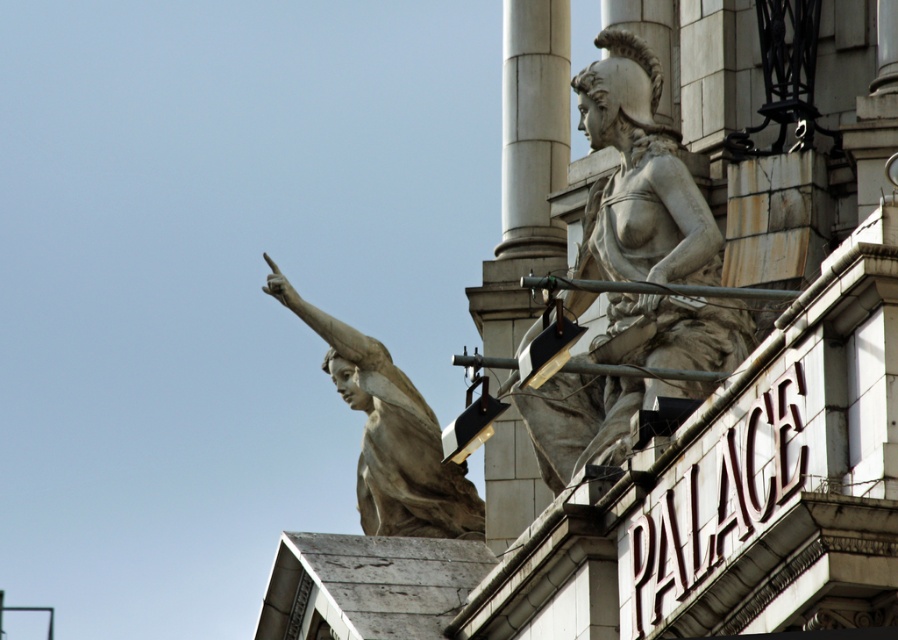
Question: Does white stone pillar at upper right have a greater width compared to matte stone statue at upper left?

Choices:
 (A) yes
 (B) no

Answer: (B)

Question: Which point is farther from the camera taking this photo?

Choices:
 (A) (693, 349)
 (B) (389, 484)

Answer: (B)

Question: From the image, what is the correct spatial relationship of stone statue at upper right in relation to matte stone statue at upper left?

Choices:
 (A) above
 (B) below

Answer: (A)

Question: Which point is closer to the camera?

Choices:
 (A) stone statue at upper right
 (B) white stone pillar at upper right

Answer: (A)

Question: Among these objects, which one is nearest to the camera?

Choices:
 (A) white stone pillar at upper right
 (B) matte stone statue at upper left
 (C) stone statue at upper right

Answer: (C)

Question: Does stone statue at upper right have a larger size compared to matte stone statue at upper left?

Choices:
 (A) yes
 (B) no

Answer: (A)